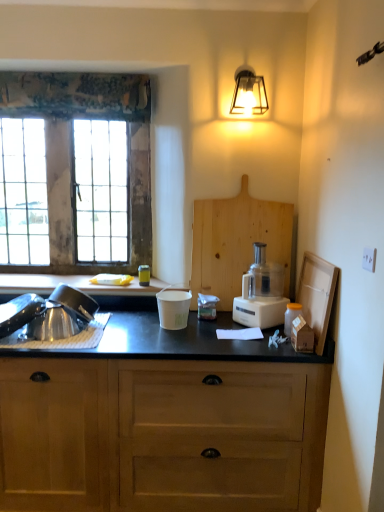
This screenshot has height=512, width=384. What do you see at coordinates (81, 170) in the screenshot?
I see `wooden window at left` at bounding box center [81, 170].

Consider the image. What is the approximate width of metallic lantern at upper right?

It is 25.60 centimeters.

At what (x,y) coordinates should I click in order to perform the action: click on black matte countertop at left. Please return your answer as a coordinate pair (x, y). The width and height of the screenshot is (384, 512). Looking at the image, I should click on [73, 285].

Where is `wooden window at left`? The height and width of the screenshot is (512, 384). wooden window at left is located at coordinates tap(81, 170).

Is white plastic food processor at center-right spatially inside wooden cabinet at lower center, or outside of it?

The correct answer is: outside.

Considering the sizes of objects white plastic food processor at center-right and wooden cabinet at lower center in the image provided, who is shorter, white plastic food processor at center-right or wooden cabinet at lower center?

With less height is white plastic food processor at center-right.

Considering the points (240, 301) and (131, 494), which point is behind, point (240, 301) or point (131, 494)?

The point (240, 301) is more distant.

Who is shorter, cardboard box at right or wooden cabinet at lower center?

cardboard box at right.

Could you tell me if cardboard box at right is facing wooden cabinet at lower center?

No, cardboard box at right does not turn towards wooden cabinet at lower center.

Is cardboard box at right at the right side of wooden cabinet at lower center?

Correct, you'll find cardboard box at right to the right of wooden cabinet at lower center.

Based on the photo, which of these two, cardboard box at right or wooden cabinet at lower center, is bigger?

wooden cabinet at lower center.

Which object is more forward, white plastic food processor at center-right or metallic lantern at upper right?

Positioned in front is white plastic food processor at center-right.

Is white plastic food processor at center-right at the right side of metallic lantern at upper right?

Indeed, white plastic food processor at center-right is positioned on the right side of metallic lantern at upper right.

Is white plastic food processor at center-right touching metallic lantern at upper right?

white plastic food processor at center-right is not next to metallic lantern at upper right, and they're not touching.

Between point (248, 109) and point (126, 285), which one is positioned in front?

The point (248, 109) is in front.

Is metallic lantern at upper right oriented towards black matte countertop at left?

No, metallic lantern at upper right is not facing towards black matte countertop at left.

Can you confirm if metallic lantern at upper right is bigger than black matte countertop at left?

Actually, metallic lantern at upper right might be smaller than black matte countertop at left.

Is metallic lantern at upper right to the right of black matte countertop at left from the viewer's perspective?

Yes.

Does wooden cabinet at lower center have a lesser width compared to metallic lantern at upper right?

Incorrect, the width of wooden cabinet at lower center is not less than that of metallic lantern at upper right.

From the picture: Is there a large distance between wooden cabinet at lower center and metallic lantern at upper right?

That's right, there is a large distance between wooden cabinet at lower center and metallic lantern at upper right.

From the image's perspective, is wooden cabinet at lower center above or below metallic lantern at upper right?

Based on their image positions, wooden cabinet at lower center is located beneath metallic lantern at upper right.

From a real-world perspective, is wooden cabinet at lower center located higher than metallic lantern at upper right?

No, from a real-world perspective, wooden cabinet at lower center is not on top of metallic lantern at upper right.

Consider the image. Is black matte countertop at left to the right of wooden cabinet at lower center from the viewer's perspective?

In fact, black matte countertop at left is to the left of wooden cabinet at lower center.

From a real-world perspective, who is located higher, black matte countertop at left or wooden cabinet at lower center?

black matte countertop at left.

Between black matte countertop at left and wooden cabinet at lower center, which one has smaller width?

black matte countertop at left.

Which is behind, point (96, 293) or point (211, 501)?

The point (96, 293) is behind.

How different are the orientations of black matte countertop at left and brushed metal sink at lower left in degrees?

black matte countertop at left and brushed metal sink at lower left are facing 0.0252 degrees away from each other.

Considering the sizes of black matte countertop at left and brushed metal sink at lower left in the image, is black matte countertop at left taller or shorter than brushed metal sink at lower left?

black matte countertop at left is taller than brushed metal sink at lower left.

Between point (20, 292) and point (37, 332), which one is positioned behind?

The point (20, 292) is farther.

From a real-world perspective, is black matte countertop at left above or below brushed metal sink at lower left?

black matte countertop at left is situated higher than brushed metal sink at lower left in the real world.

Locate an element on the screen. The height and width of the screenshot is (512, 384). cabinetry beneath the white plastic food processor at center-right (from a real-world perspective) is located at coordinates (162, 435).

The width and height of the screenshot is (384, 512). Find the location of `cabinetry behind the cardboard box at right`. cabinetry behind the cardboard box at right is located at coordinates (162, 435).

Looking at the image, which one is located closer to wooden window at left, white plastic food processor at center-right or brushed metal sink at lower left?

brushed metal sink at lower left lies closer to wooden window at left than the other object.

Looking at the image, which one is located closer to cardboard box at right, wooden window at left or wooden cabinet at lower center?

wooden cabinet at lower center is positioned closer to the anchor cardboard box at right.

Considering their positions, is cardboard box at right positioned closer to white plastic food processor at center-right than wooden cabinet at lower center?

cardboard box at right.

When comparing their distances from brushed metal sink at lower left, does wooden window at left or wooden cabinet at lower center seem closer?

wooden cabinet at lower center lies closer to brushed metal sink at lower left than the other object.

When comparing their distances from black matte countertop at left, does wooden window at left or cardboard box at right seem further?

The object further to black matte countertop at left is cardboard box at right.

Considering their positions, is wooden window at left positioned closer to white plastic food processor at center-right than black matte countertop at left?

black matte countertop at left lies closer to white plastic food processor at center-right than the other object.

Based on their spatial positions, is metallic lantern at upper right or cardboard box at right closer to white plastic food processor at center-right?

cardboard box at right lies closer to white plastic food processor at center-right than the other object.

Estimate the real-world distances between objects in this image. Which object is closer to wooden cabinet at lower center, cardboard box at right or black matte countertop at left?

cardboard box at right.

Where is `light fixture between wooden window at left and white plastic food processor at center-right from left to right`? light fixture between wooden window at left and white plastic food processor at center-right from left to right is located at coordinates (248, 93).

Where is `sink located between wooden window at left and cardboard box at right in the left-right direction`? sink located between wooden window at left and cardboard box at right in the left-right direction is located at coordinates (52, 320).

At what (x,y) coordinates should I click in order to perform the action: click on sink between wooden cabinet at lower center and black matte countertop at left from front to back. Please return your answer as a coordinate pair (x, y). The height and width of the screenshot is (512, 384). Looking at the image, I should click on (52, 320).

The width and height of the screenshot is (384, 512). I want to click on kitchen appliance between metallic lantern at upper right and cardboard box at right in the vertical direction, so click(x=261, y=293).